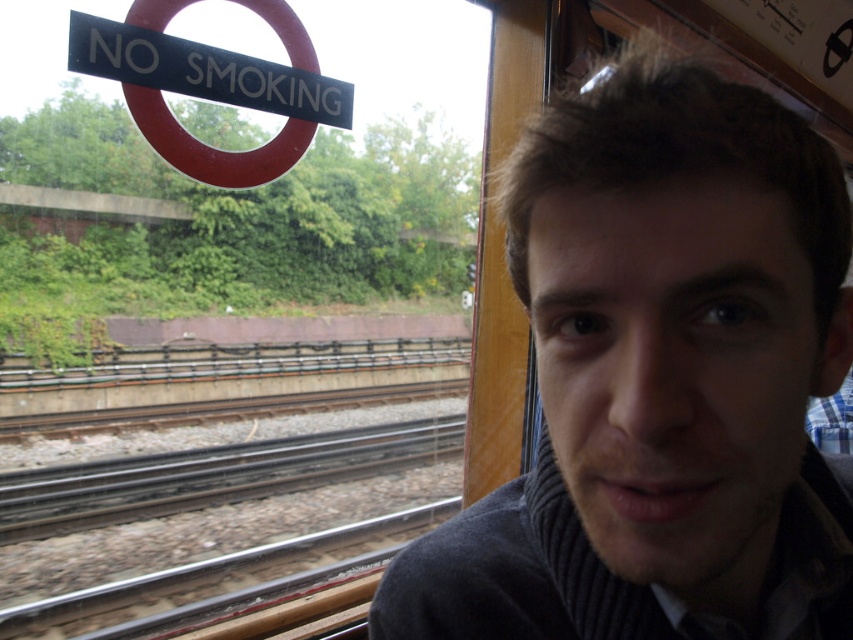
Question: Does gray ribbed sweater at right have a lesser width compared to black plastic sign at upper left?

Choices:
 (A) yes
 (B) no

Answer: (A)

Question: Which point is closer to the camera?

Choices:
 (A) transparent glass at center
 (B) gray ribbed sweater at right

Answer: (B)

Question: Can you confirm if gray ribbed sweater at right is positioned above black plastic sign at upper left?

Choices:
 (A) no
 (B) yes

Answer: (A)

Question: Which point is farther to the camera?

Choices:
 (A) transparent glass at center
 (B) black plastic sign at upper left
 (C) gray ribbed sweater at right

Answer: (A)

Question: Observing the image, what is the correct spatial positioning of gray ribbed sweater at right in reference to black plastic sign at upper left?

Choices:
 (A) below
 (B) above

Answer: (A)

Question: Which object appears farthest from the camera in this image?

Choices:
 (A) black plastic sign at upper left
 (B) gray ribbed sweater at right

Answer: (A)